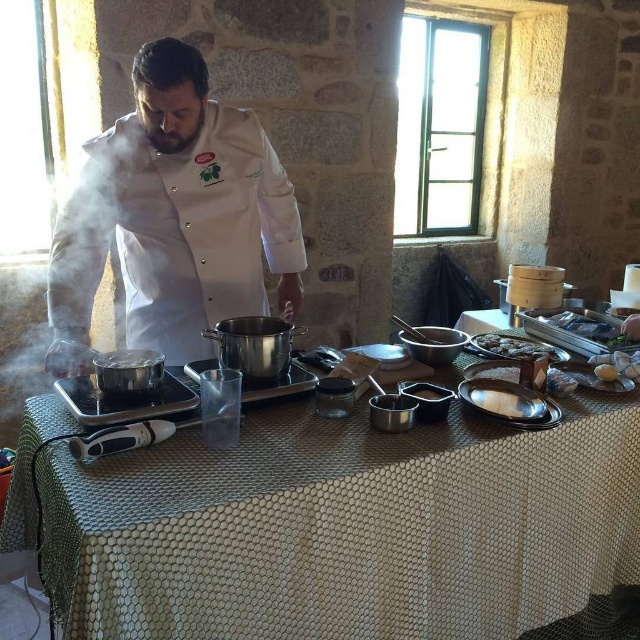
Can you confirm if shiny silver tray at right is smaller than white paper towel at lower right?

Result: No.

Is shiny silver tray at right below white paper towel at lower right?

Actually, shiny silver tray at right is above white paper towel at lower right.

The image size is (640, 640). I want to click on shiny silver tray at right, so click(x=577, y=328).

Does white matte chef coat at center have a greater width compared to white paper towel at lower right?

Correct, the width of white matte chef coat at center exceeds that of white paper towel at lower right.

Is point (136, 305) less distant than point (499, 392)?

No, it is behind (499, 392).

This screenshot has width=640, height=640. What are the coordinates of `white matte chef coat at center` in the screenshot? It's located at (173, 216).

Does metallic silver table at center appear on the right side of dark brown glossy meat at center?

Incorrect, metallic silver table at center is not on the right side of dark brown glossy meat at center.

Does metallic silver table at center have a greater width compared to dark brown glossy meat at center?

Correct, the width of metallic silver table at center exceeds that of dark brown glossy meat at center.

Locate an element on the screen. This screenshot has width=640, height=640. metallic silver table at center is located at coordinates (346, 529).